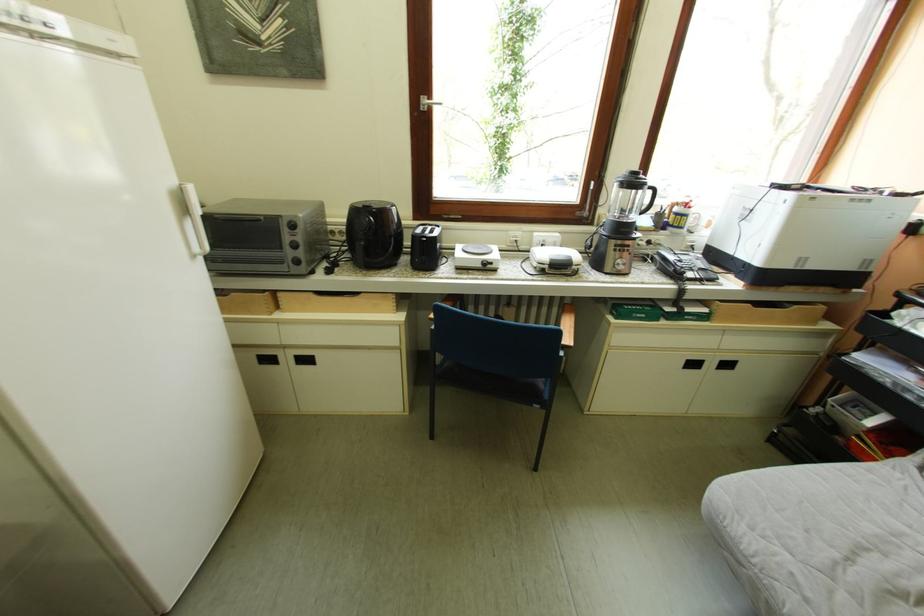
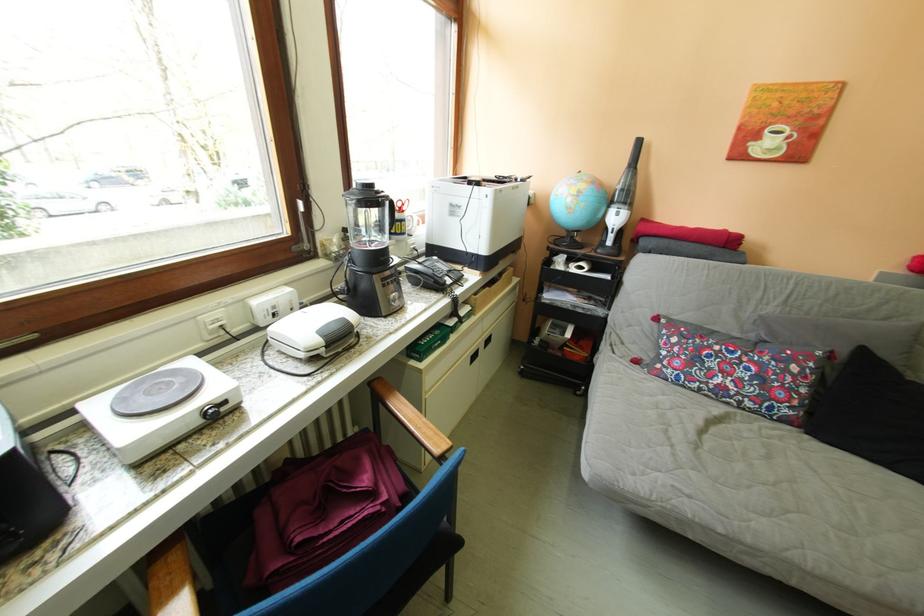
Find the pixel in the second image that matches (715,270) in the first image.

(460, 272)